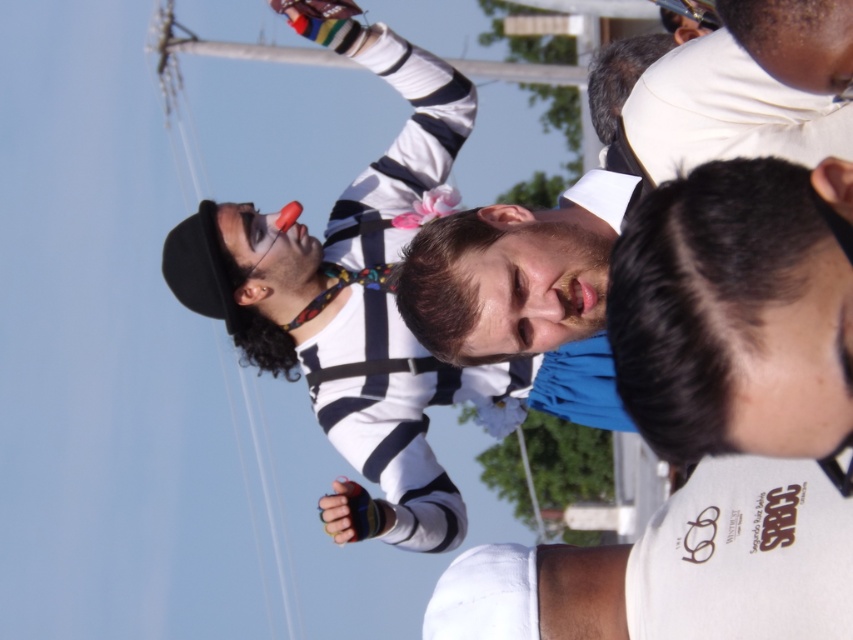
You are standing at the center of the scene and want to locate the matte striped shirt at left. According to the coordinates provided, in which direction should you look to find it?

The matte striped shirt at left is located at coordinates point (355, 304). Since you are at the center, you should look to your left to find it.